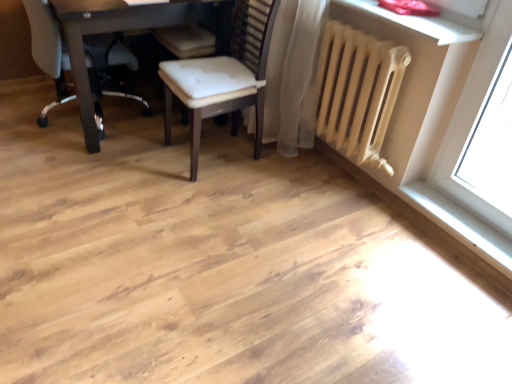
Locate an element on the screen. blank space situated above white smooth window sill at lower right (from a real-world perspective) is located at coordinates (466, 219).